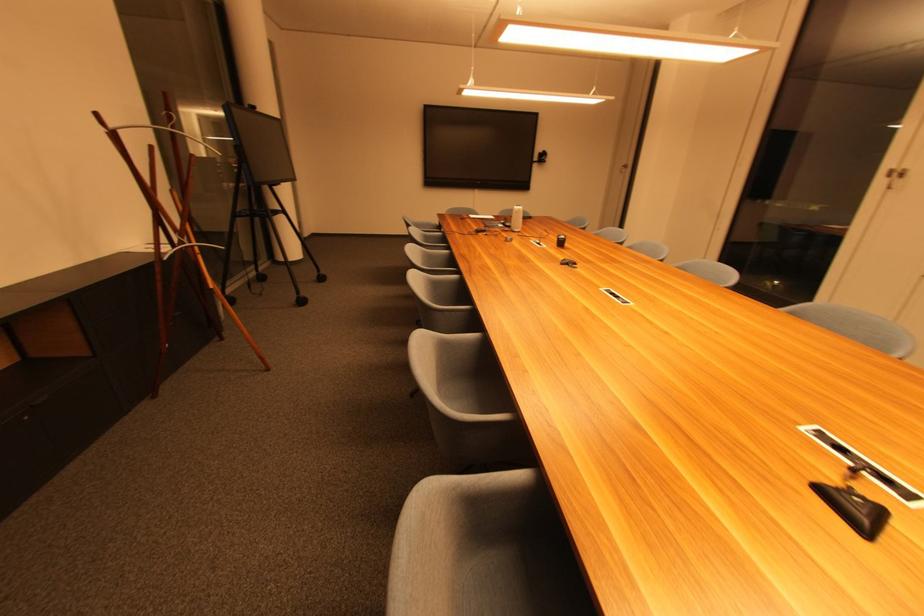
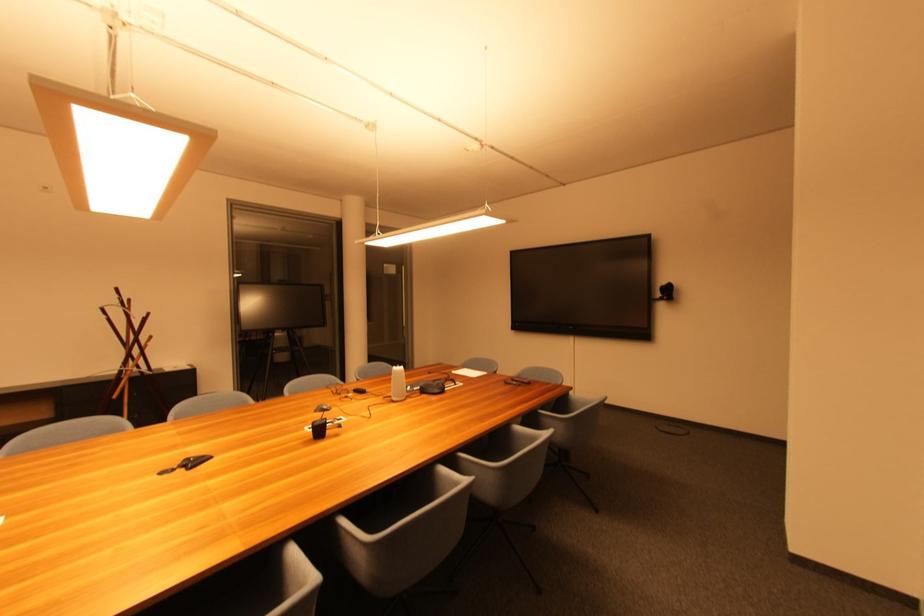
Where in the second image is the point corresponding to the point at 525,211 from the first image?

(399, 373)